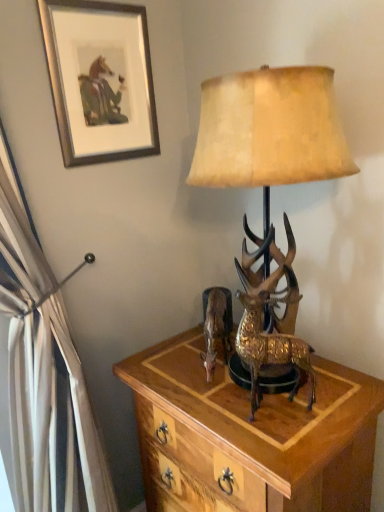
At what (x,y) coordinates should I click in order to perform the action: click on vacant area that lies between metallic gold reindeer at center and gold textured deer at center. Please return your answer as a coordinate pair (x, y). This screenshot has height=512, width=384. Looking at the image, I should click on (243, 391).